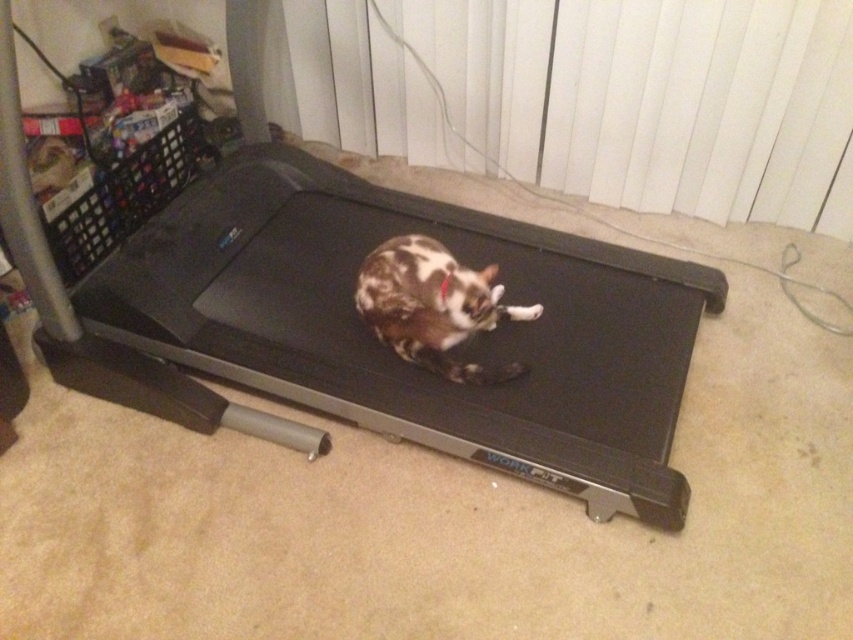
You are a delivery person who needs to place a box on the treadmill. The box is 1.2 meters wide. Can the box fit on the black rubber treadmill at center if the brown spotted fur cat at center is already lying there?

The black rubber treadmill at center is wider than the brown spotted fur cat at center, so the box that is 1.2 meters wide might fit if the cat moves aside. However, the exact available space depends on the cat not occupying the entire width of the treadmill.

You are a delivery person who needs to place a small package on top of the black rubber treadmill at center. However, there is a brown spotted fur cat at center already lying there. Can the cat move to the side to make space for the package?

The black rubber treadmill at center is taller than the brown spotted fur cat at center, so the cat has enough space to move to the side of the treadmill to make room for the package.

You are a delivery person standing at the entrance of the room. You need to place a large package that is 5 feet long on the floor. The package must be placed as close as possible to the black rubber treadmill at center without touching it. Is there enough space between the entrance and the treadmill to place the package?

The black rubber treadmill at center is 4.36 feet away from the camera. Since the package is 5 feet long, placing it as close as possible to the treadmill without touching it would require at least 5 feet of space. However, the distance from the entrance to the treadmill is not provided, so it is impossible to determine if there is enough space.